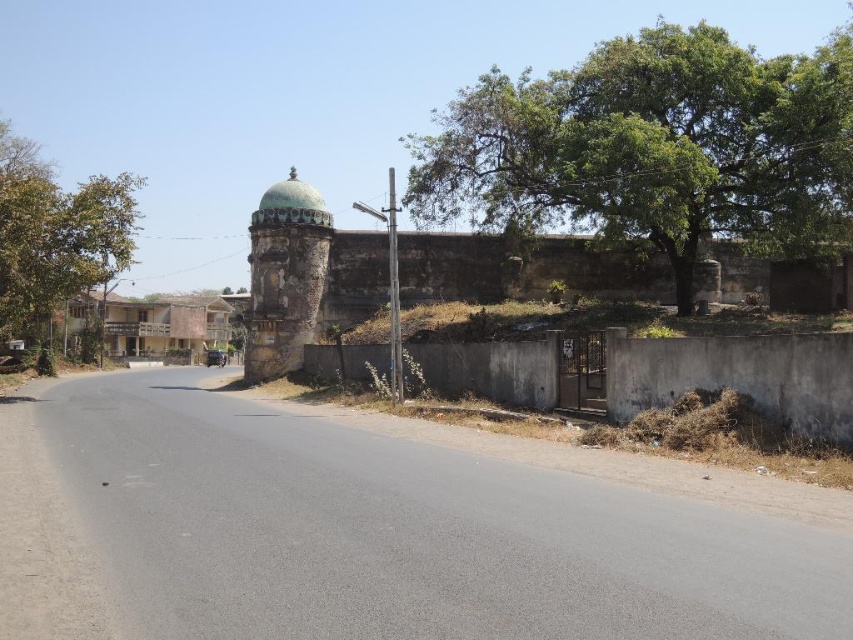
Question: Is green leafy tree at upper right positioned in front of rusty stone fort at center?

Choices:
 (A) yes
 (B) no

Answer: (A)

Question: Which point is closer to the camera?

Choices:
 (A) green leafy tree at left
 (B) rusty stone fort at center
 (C) green leafy tree at upper right

Answer: (A)

Question: Which object is farther from the camera taking this photo?

Choices:
 (A) rusty stone fort at center
 (B) green leafy tree at left
 (C) green leafy tree at upper right

Answer: (A)

Question: Where is rusty stone fort at center located in relation to green leafy tree at left in the image?

Choices:
 (A) above
 (B) below

Answer: (B)

Question: Does green leafy tree at upper right have a lesser width compared to rusty stone fort at center?

Choices:
 (A) yes
 (B) no

Answer: (B)

Question: Which object is positioned closest to the rusty stone fort at center?

Choices:
 (A) green leafy tree at upper right
 (B) green leafy tree at left

Answer: (A)